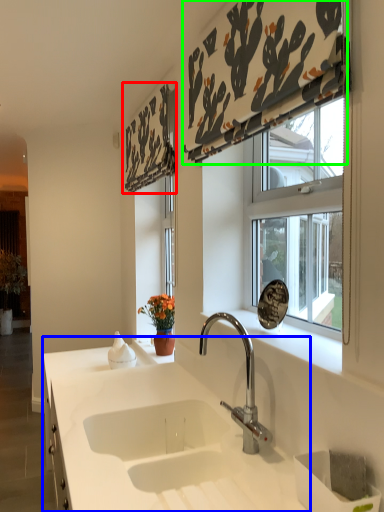
Question: Which object is the closest to the curtain (highlighted by a red box)? Choose among these: countertop (highlighted by a blue box) or curtain (highlighted by a green box).

Choices:
 (A) countertop
 (B) curtain

Answer: (B)